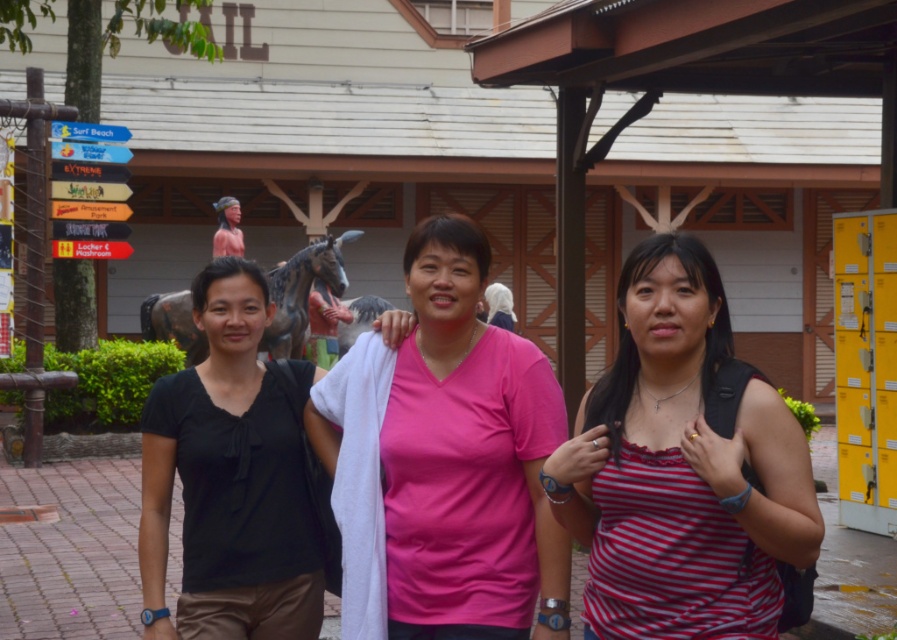
You are at a theme park and see two people wearing striped cotton tank top at center and black matte shirt at left. Which one is standing to the left of the other?

The black matte shirt at left is standing to the left of the striped cotton tank top at center.

You are standing at the signpost pointing towards Surf Beach, Water Park, and Extreme Park. You see two points marked in the scene. Which point is closer to you, point (605, 378) or point (384, 428)?

Point (605, 378) is closer to you than point (384, 428).

You are standing at the signpost pointing to Surf Beach, Water Park, and Extreme Park. There is a point at coordinates (466, 460) in the image. Which object is this point located on?

The point at (466, 460) is located on the pink matte shirt at center.